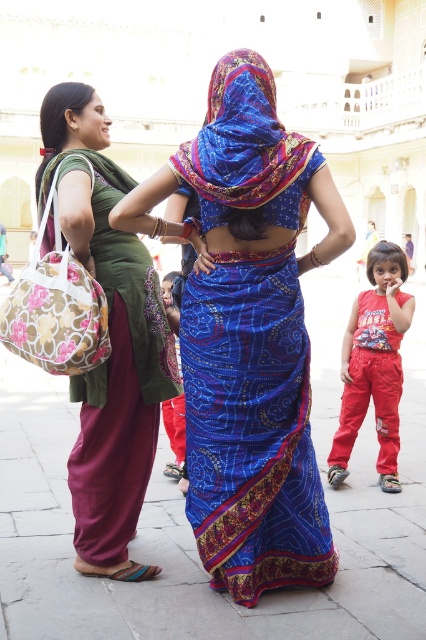
Is matte green sari at left taller than green silk sari at left?

Correct, matte green sari at left is much taller as green silk sari at left.

Does point (109, 488) lie in front of point (169, 352)?

Yes.

Locate an element on the screen. matte green sari at left is located at coordinates (109, 337).

Who is shorter, blue printed sari at center or red cotton pants at lower right?

With less height is blue printed sari at center.

Locate an element on the screen. blue printed sari at center is located at coordinates (241, 140).

Is point (241, 96) more distant than point (368, 268)?

No, (241, 96) is closer to viewer.

Identify the location of blue printed sari at center. (241, 140).

Between matte green sari at left and red cotton pants at lower right, which one appears on the right side from the viewer's perspective?

From the viewer's perspective, red cotton pants at lower right appears more on the right side.

The height and width of the screenshot is (640, 426). I want to click on matte green sari at left, so click(x=109, y=337).